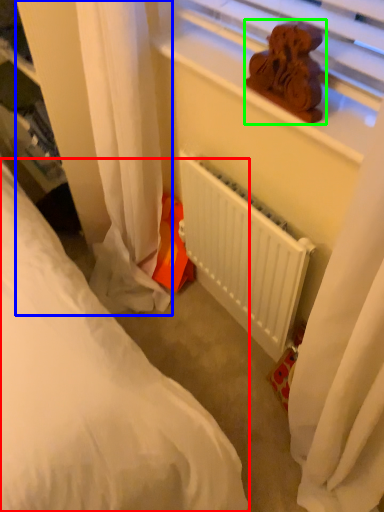
Question: Based on their relative distances, which object is farther from bed (highlighted by a red box)? Choose from curtain (highlighted by a blue box) and miniature (highlighted by a green box).

Choices:
 (A) curtain
 (B) miniature

Answer: (B)